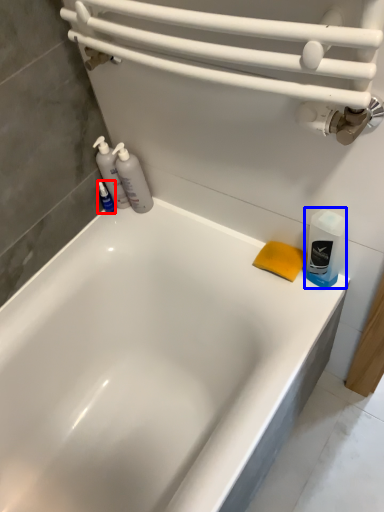
Question: Which of the following is the farthest to the observer, toiletry (highlighted by a red box) or cleaning product (highlighted by a blue box)?

Choices:
 (A) toiletry
 (B) cleaning product

Answer: (A)